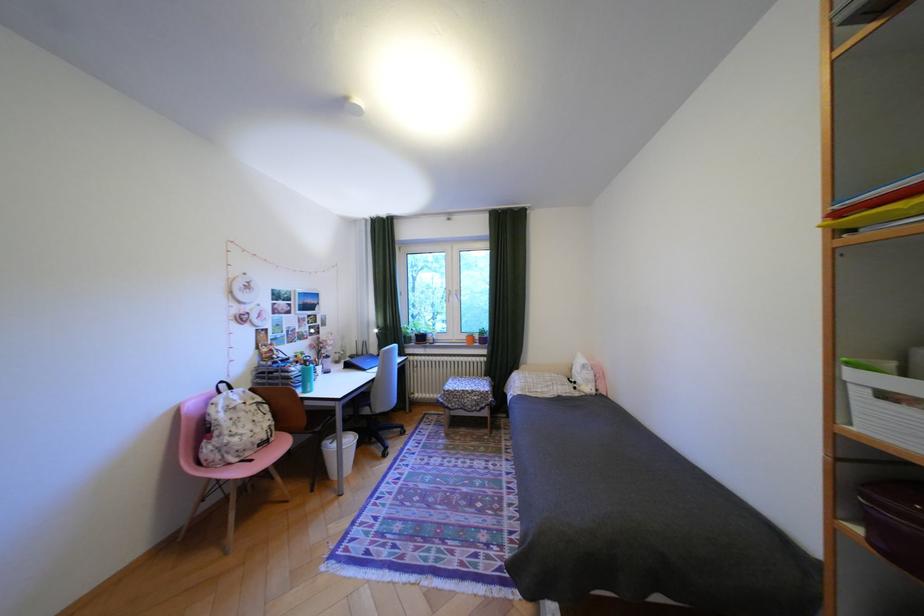
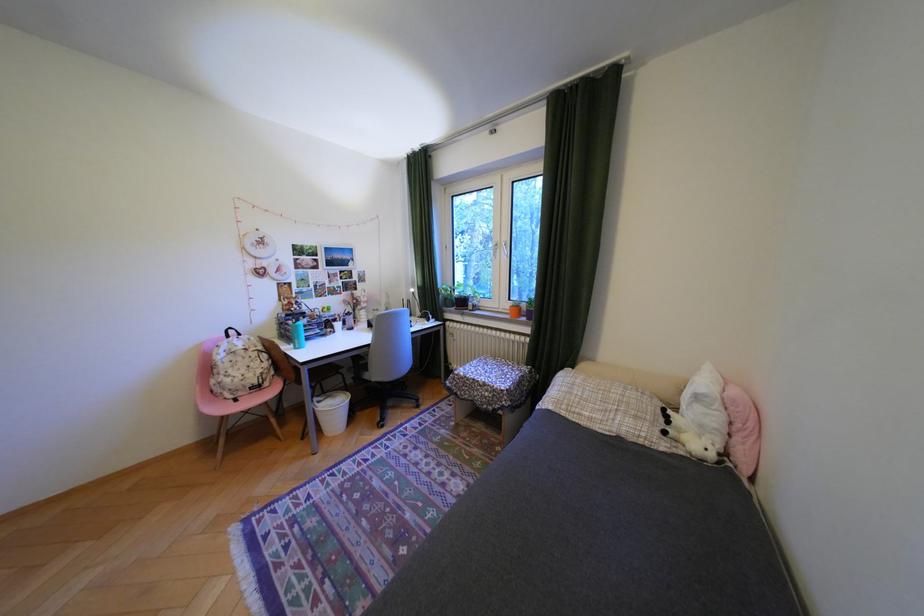
Question: I am providing you with two images of the same scene from different viewpoints. Please identify which objects are invisible in image2.

Choices:
 (A) blue water bottle
 (B) window handle
 (C) pink chair sitting surface
 (D) none of these

Answer: (D)